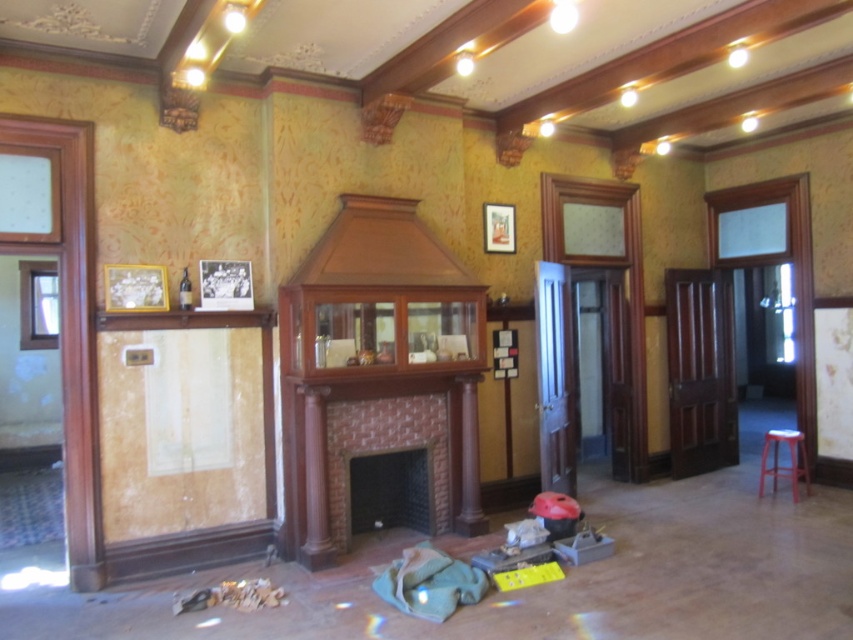
Question: Does brown wood/marble mantle at upper left have a larger size compared to black matte photo frame at upper left?

Choices:
 (A) no
 (B) yes

Answer: (B)

Question: Which of the following is the closest to the observer?

Choices:
 (A) matte gold picture frame at upper center
 (B) brick fireplace at center

Answer: (B)

Question: Is brown polished wood pillar at center above matte gold picture frame at upper center?

Choices:
 (A) no
 (B) yes

Answer: (A)

Question: Considering the real-world distances, which object is farthest from the brick fireplace at center?

Choices:
 (A) black matte photo frame at upper left
 (B) brown wood/marble mantle at upper left
 (C) wooden picture frame at upper left
 (D) matte gold picture frame at upper center

Answer: (D)

Question: Is brick fireplace at center further to the viewer compared to matte plastic stool at right?

Choices:
 (A) no
 (B) yes

Answer: (A)

Question: Estimate the real-world distances between objects in this image. Which object is farther from the matte plastic stool at right?

Choices:
 (A) brown polished wood pillar at center
 (B) brown wood/marble mantle at upper left

Answer: (B)